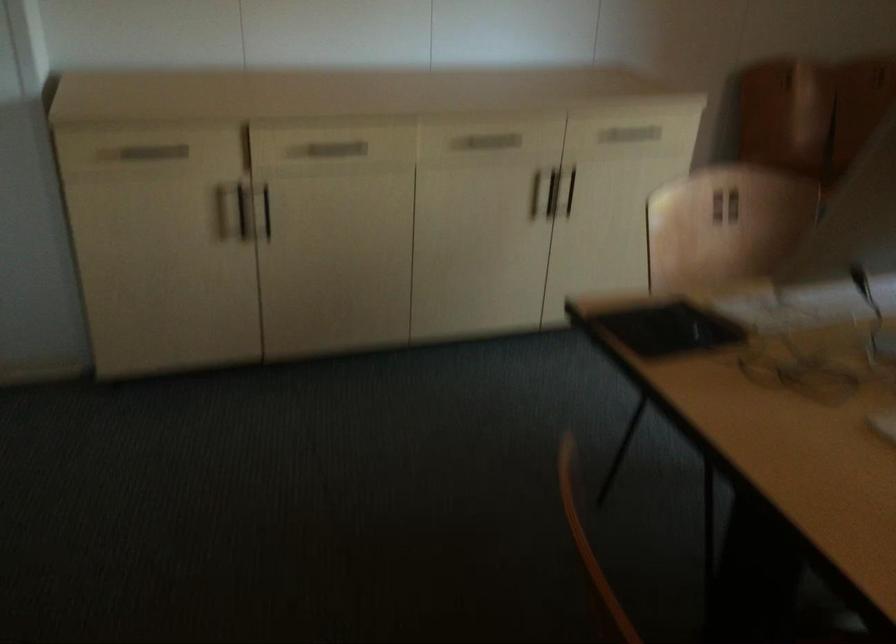
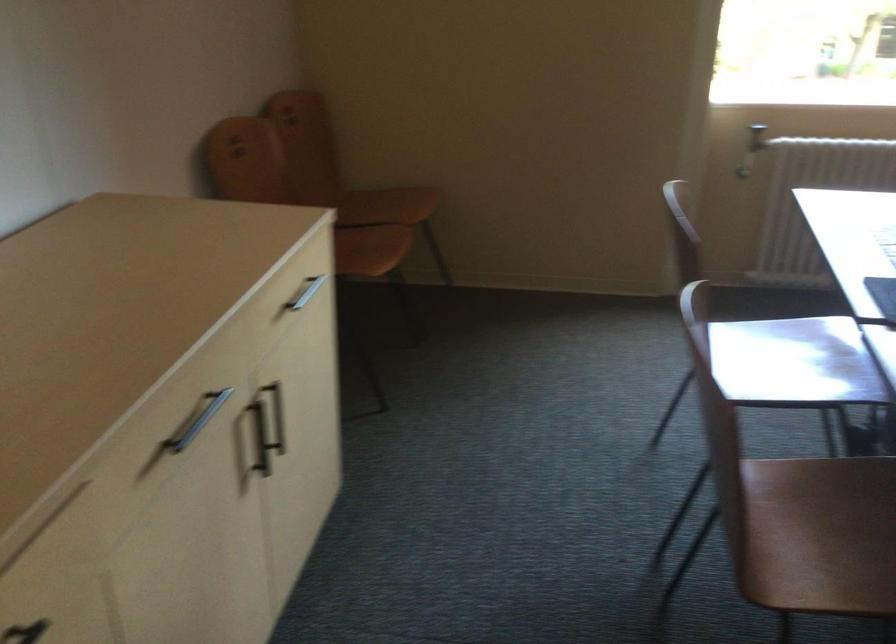
In the second image, find the point that corresponds to pixel 645 138 in the first image.

(305, 292)